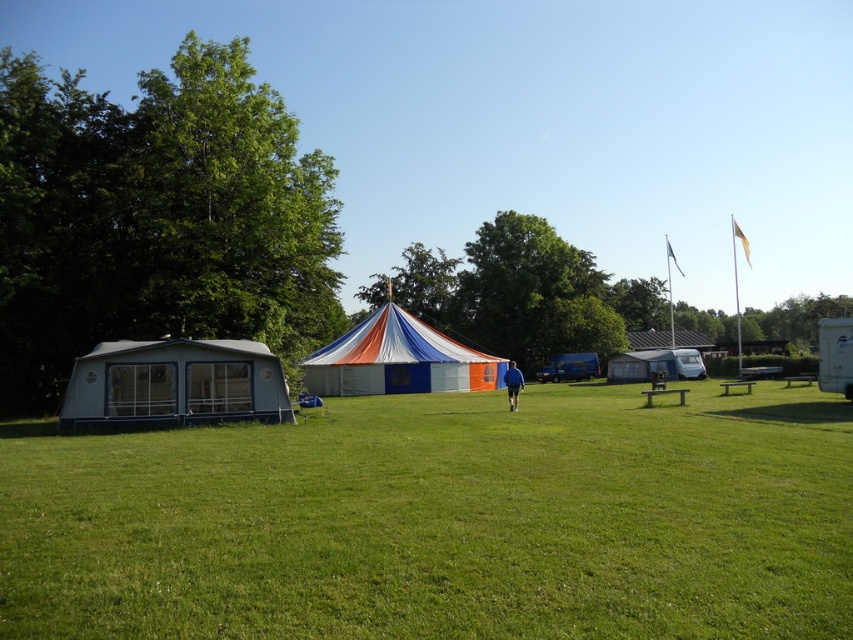
Who is more forward, (120, 396) or (486, 372)?

Point (120, 396)

Can you confirm if matte blue tent at left is thinner than white canvas tent at center?

Yes, matte blue tent at left is thinner than white canvas tent at center.

Is point (161, 360) more distant than point (392, 305)?

No, it is not.

Find the location of a particular element. Image resolution: width=853 pixels, height=640 pixels. matte blue tent at left is located at coordinates (173, 385).

Can you confirm if green grassy field at lower center is taller than white canvas tent at center?

Incorrect, green grassy field at lower center's height is not larger of white canvas tent at center's.

Is point (824, 504) positioned before point (352, 365)?

That is True.

Does point (735, 460) lie in front of point (379, 339)?

Yes, it is in front of point (379, 339).

The height and width of the screenshot is (640, 853). In order to click on green grassy field at lower center in this screenshot , I will do `click(442, 520)`.

Between green grassy field at lower center and matte blue tent at left, which one appears on the right side from the viewer's perspective?

Positioned to the right is green grassy field at lower center.

Which is behind, point (517, 618) or point (233, 381)?

The point (233, 381) is behind.

Is point (544, 547) less distant than point (115, 376)?

Yes.

I want to click on green grassy field at lower center, so click(x=442, y=520).